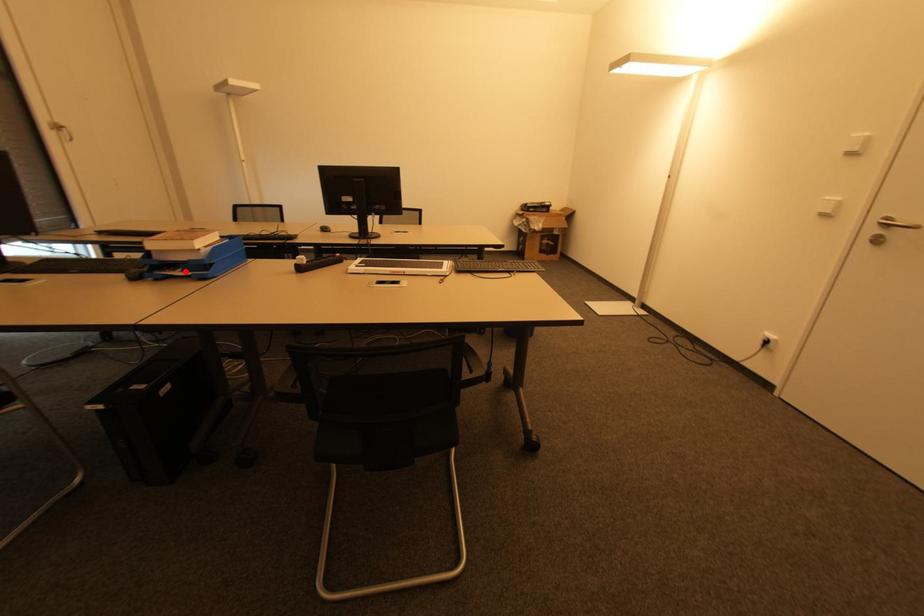
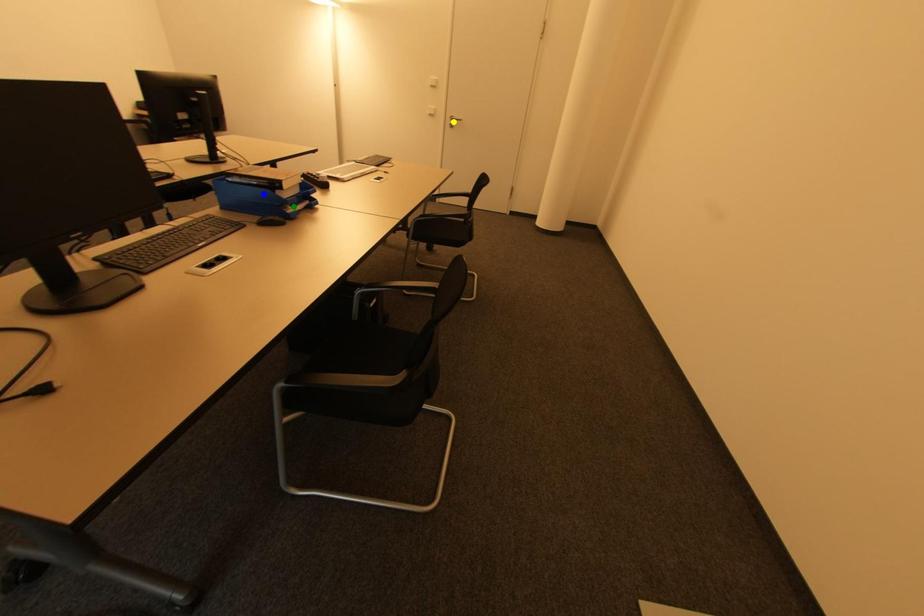
Question: I am providing you with two images of the same scene from different viewpoints. A red point is marked on the first image. You are given multiple points on the second image. Which mark in image 2 goes with the point in image 1?

Choices:
 (A) blue point
 (B) yellow point
 (C) green point

Answer: (C)